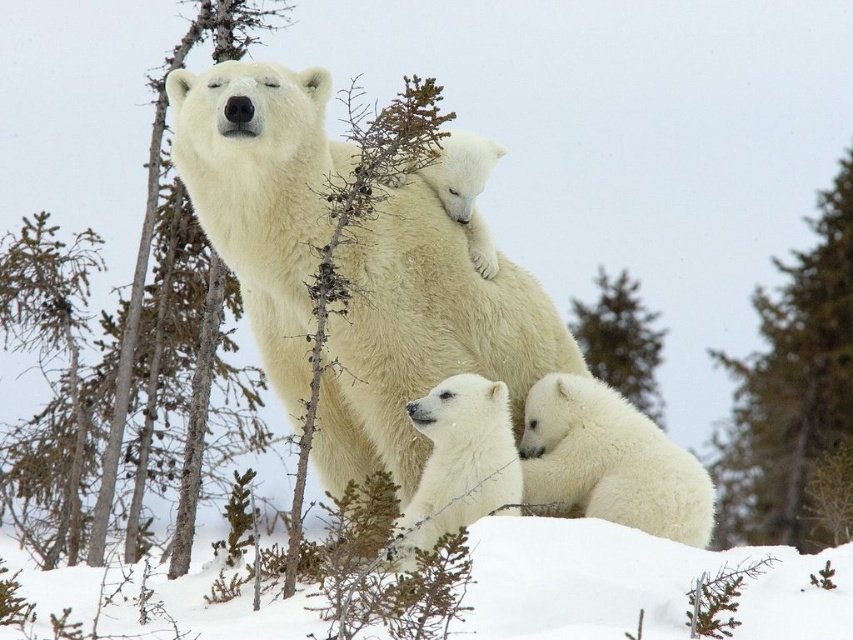
Consider the image. You are a photographer trying to capture a clear image of the white fluffy polar bear at center and the white fluffy snow at lower center. Since both are white, how can you tell which one is closer to you?

The white fluffy snow at lower center is behind the white fluffy polar bear at center, so the polar bear is closer to you than the snow.

You are a wildlife photographer trying to capture a photo of the white fluffy polar bear at center and the white fluffy snow at lower center. You need to ensure that both subjects are in focus. Given that your camera can only focus on objects within a 2.5 meter range, will both subjects be in focus?

The white fluffy polar bear at center is 2.28 meters from white fluffy snow at lower center. Since the distance between them is within the 2.5 meter range, both subjects will be in focus.

You are a wildlife photographer trying to capture a photo of the white fluffy polar bear at center. Your camera has a zoom lens with a focal length of 300mm. If you are standing at point A, which is 10 meters away from the polar bear, can you adjust the focal length to ensure the bear fills the frame without moving closer? Explain your reasoning.

The white fluffy polar bear at center is located at point coordinates, but without knowing the exact distance between the photographer and the bear or the camera sensor size, it is impossible to determine if adjusting the focal length would allow the bear to fill the frame without moving closer. However, a 300mm focal length on most cameras can typically fill the frame with a subject at 10 meters distance, so the photographer might be able to achieve this without moving closer.